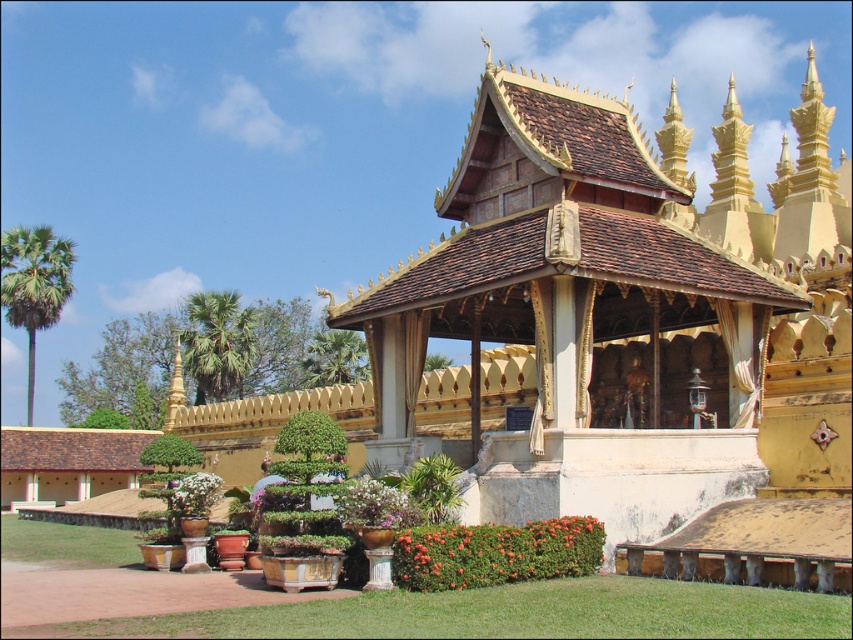
You are a visitor standing in front of the pavilion and want to take a photo of the golden wood gazebo at center and the white matte flowers at center. If you want to include both in your photo without moving your position, which object should you frame first to ensure both are visible?

The golden wood gazebo at center is to the right of white matte flowers at center. To include both in your photo without moving, frame the white matte flowers at center first since it is on the left side, allowing space for the gazebo to the right.

You are standing in front of the pavilion and want to place a new decorative item. You have a golden statue that needs to be placed at point (x=495, y=552). However, there is already an object there. What is the object currently occupying that location?

The point at (x=495, y=552) is currently occupied by a green leafy bush at lower center.

You are standing in the garden area of the pavilion and want to walk from point A to point B. Point A is at coordinates point (473, 189) and point B is at coordinates point (374, 483). Which point should you start from to reach the other without going through the pavilion structure?

You should start from point (374, 483) to reach point (473, 189) because point (473, 189) is behind point (374, 483) relative to the pavilion structure.